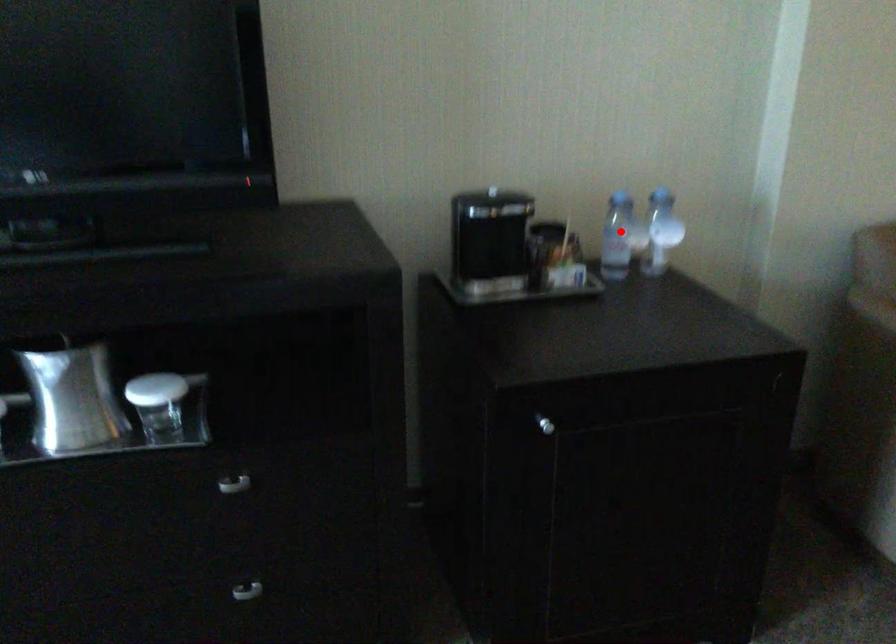
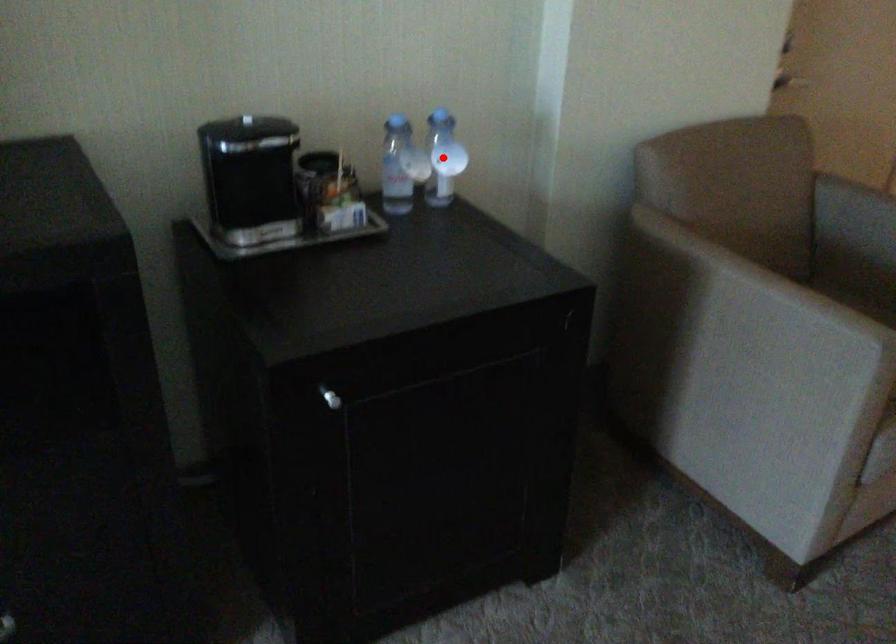
I am providing you with two images of the same scene from different viewpoints. A red point is marked on the first image and another point is marked on the second image. Is the red point in image1 aligned with the point shown in image2?

No